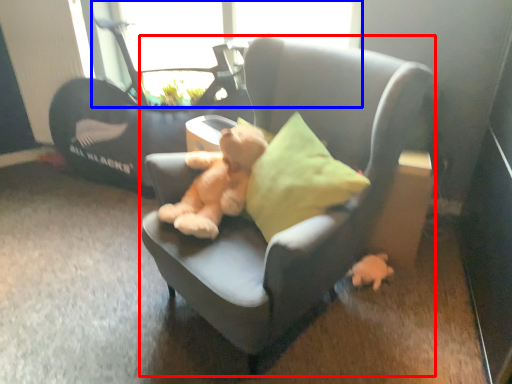
Question: Among these objects, which one is nearest to the camera, chair (highlighted by a red box) or window screen (highlighted by a blue box)?

Choices:
 (A) chair
 (B) window screen

Answer: (A)